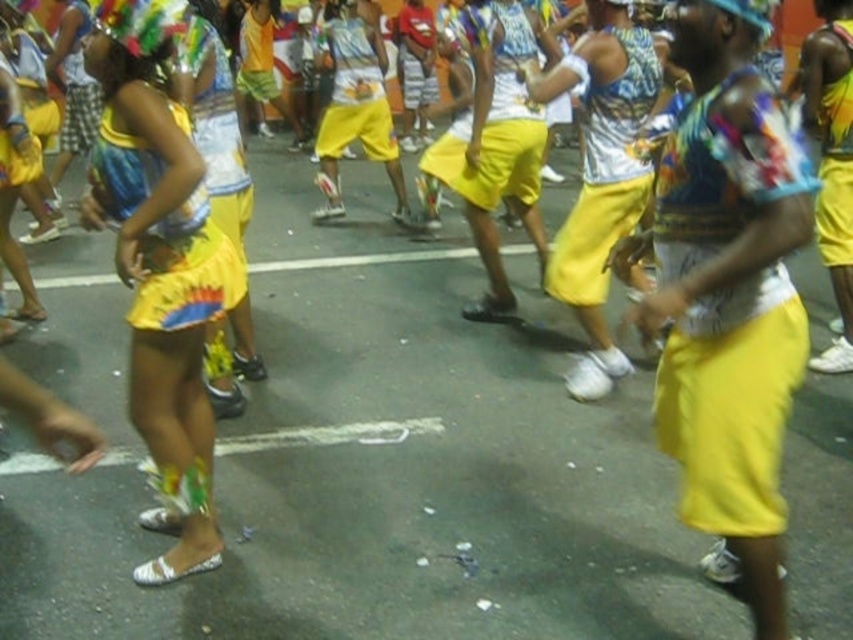
You are a photographer positioned at the origin point of the image. You want to capture a close shot of the shiny metallic skirt at left. Which direction should you move to get closer to it?

The shiny metallic skirt at left is located at point 0.417 on the x axis and 0.189 on the y axis. Since you are at the origin, you should move towards the positive x and positive y direction to reach it.

You are a photographer standing on the street and want to capture both the matte yellow skirt at center and the shiny metallic shorts at right in your photo. Which object is positioned lower in the frame?

The matte yellow skirt at center is positioned below the shiny metallic shorts at right, so it is lower in the frame.

You are a photographer trying to capture the vibrant colors of the festive event. You notice the matte yellow skirt at center and the shiny metallic shorts at right. Which object would you focus on if you want to highlight a larger item in your photo?

The matte yellow skirt at center is larger in size than the shiny metallic shorts at right, so focusing on the matte yellow skirt at center would highlight a larger item in the photo.